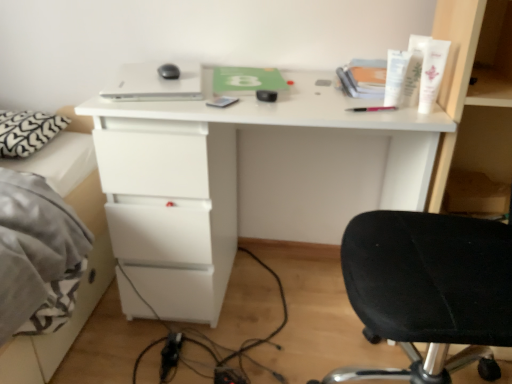
Question: From the image's perspective, is white matte desk at center positioned above or below white cream tube at upper right, the 3th toiletry positioned from the right?

Choices:
 (A) above
 (B) below

Answer: (B)

Question: In terms of width, does white matte desk at center look wider or thinner when compared to white cream tube at upper right, the 3th toiletry positioned from the right?

Choices:
 (A) thin
 (B) wide

Answer: (B)

Question: Considering the real-world distances, which object is farthest from the white cream tube at upper right, the 3th toiletry positioned from the right?

Choices:
 (A) white heart-patterned pillow at left
 (B) white matte desk at center
 (C) white plastic tube at upper right, which is counted as the 1th toiletry, starting from the right
 (D) matte gray notepad at center
 (E) white plastic tube at upper right, which is the 2th toiletry in right-to-left order

Answer: (A)

Question: Considering the real-world distances, which object is farthest from the matte gray notepad at center?

Choices:
 (A) white matte desk at center
 (B) white plastic tube at upper right, which is the 2th toiletry in right-to-left order
 (C) white cream tube at upper right, the 3th toiletry positioned from the right
 (D) white plastic tube at upper right, which is counted as the 1th toiletry, starting from the right
 (E) white heart-patterned pillow at left

Answer: (E)